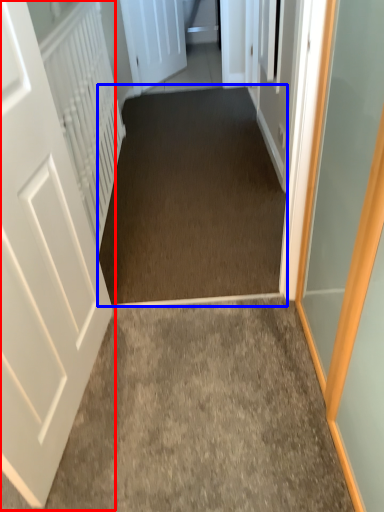
Question: Which point is further to the camera, door (highlighted by a red box) or corridor (highlighted by a blue box)?

Choices:
 (A) door
 (B) corridor

Answer: (B)